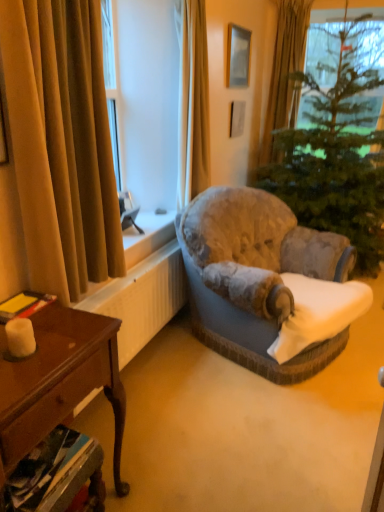
Question: Considering the positions of velvet grey armchair at center and matte silver picture frame at upper center in the image, is velvet grey armchair at center bigger or smaller than matte silver picture frame at upper center?

Choices:
 (A) big
 (B) small

Answer: (A)

Question: Is point (246, 250) positioned closer to the camera than point (231, 53)?

Choices:
 (A) farther
 (B) closer

Answer: (B)

Question: Considering the real-world distances, which object is farthest from the gold velvet curtain at upper right, which is the third curtain from left to right?

Choices:
 (A) velvet gold curtain at left, placed as the 3th curtain when sorted from back to front
 (B) white textured radiator at lower left
 (C) matte silver picture frame at upper center
 (D) velvet grey armchair at center
 (E) white matte candle at lower left

Answer: (E)

Question: Which object is positioned closest to the green textured christmas tree at center?

Choices:
 (A) matte silver picture frame at upper center
 (B) white matte candle at lower left
 (C) velvet gold curtain at left, placed as the 3th curtain when sorted from back to front
 (D) gold velvet curtain at upper right, which ranks as the first curtain in back-to-front order
 (E) white textured radiator at lower left

Answer: (A)